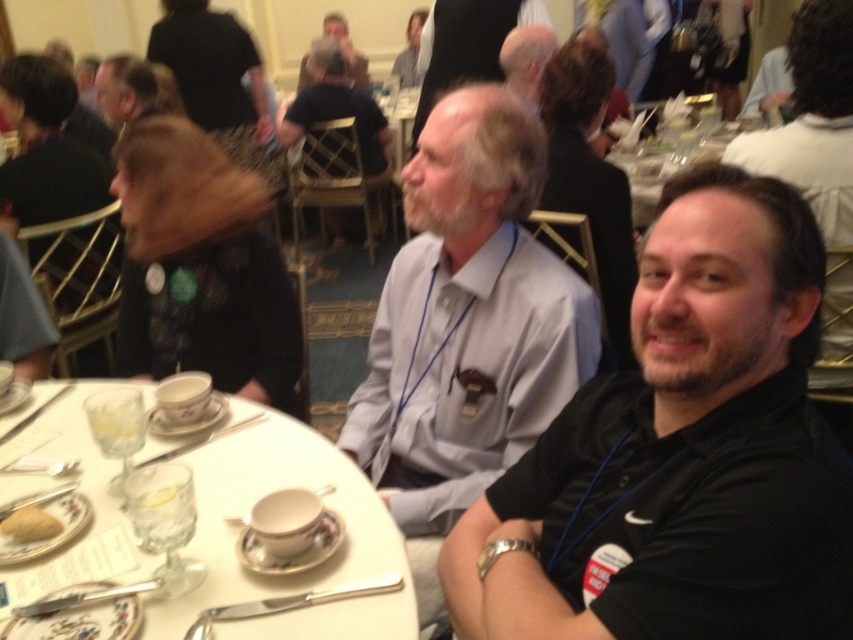
Question: Can you confirm if black shirt at center is positioned above white porcelain table at center?

Choices:
 (A) no
 (B) yes

Answer: (A)

Question: From the image, what is the correct spatial relationship of light blue shirt at center in relation to white porcelain tableware at center?

Choices:
 (A) left
 (B) right

Answer: (B)

Question: Which point is farther to the camera?

Choices:
 (A) (329, 17)
 (B) (231, 484)
 (C) (529, 396)
 (D) (523, 51)

Answer: (A)

Question: Does black shirt at center have a smaller size compared to matte black hair at upper center?

Choices:
 (A) yes
 (B) no

Answer: (A)

Question: Which point is farther to the camera?

Choices:
 (A) (431, 397)
 (B) (112, 512)
 (C) (326, 17)
 (D) (4, 532)

Answer: (C)

Question: Which object appears closest to the camera in this image?

Choices:
 (A) white porcelain saucer at lower left
 (B) white porcelain table at center
 (C) golden brown bread at lower left
 (D) black shirt at center

Answer: (D)